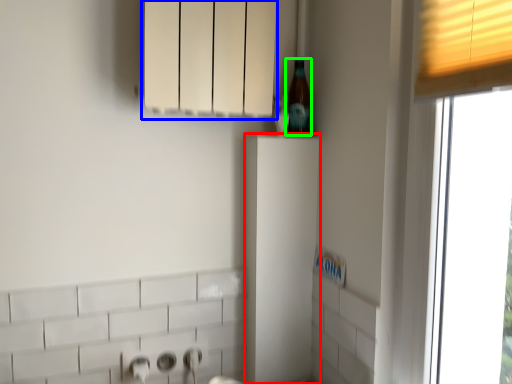
Question: Estimate the real-world distances between objects in this image. Which object is farther from cabinetry (highlighted by a red box), cabinetry (highlighted by a blue box) or beer bottle (highlighted by a green box)?

Choices:
 (A) cabinetry
 (B) beer bottle

Answer: (A)